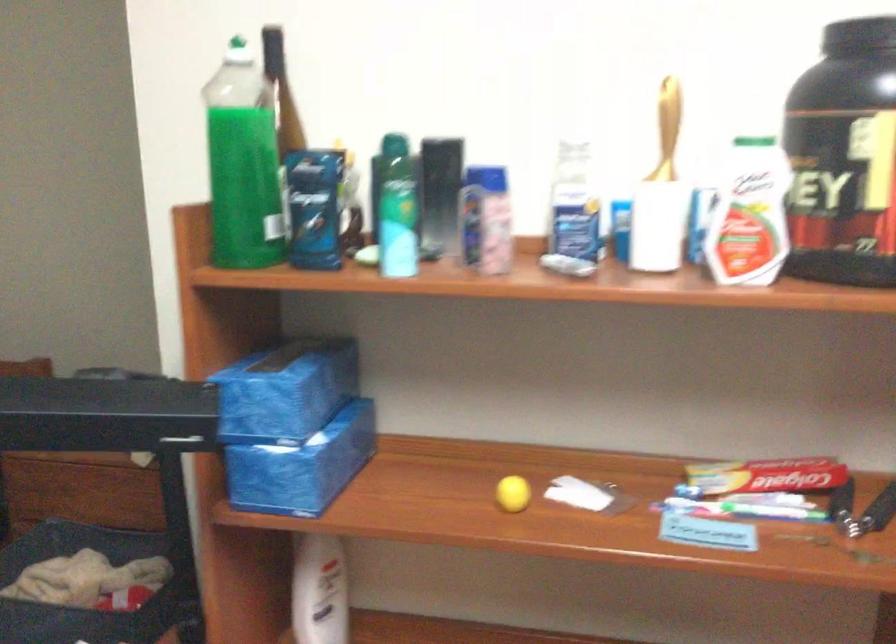
Find where to lift the dark glass bottle. Please return your answer as a coordinate pair (x, y).

(438, 194)